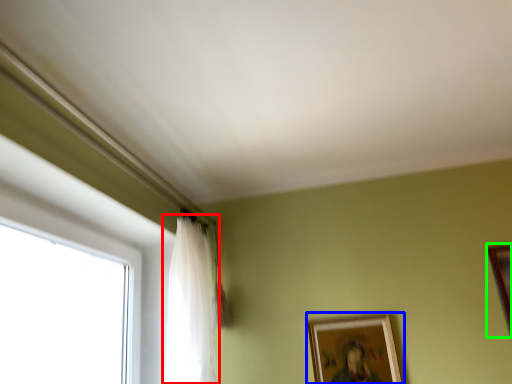
Question: Considering the real-world distances, which object is farthest from curtain (highlighted by a red box)? picture frame (highlighted by a blue box) or picture frame (highlighted by a green box)?

Choices:
 (A) picture frame
 (B) picture frame

Answer: (B)